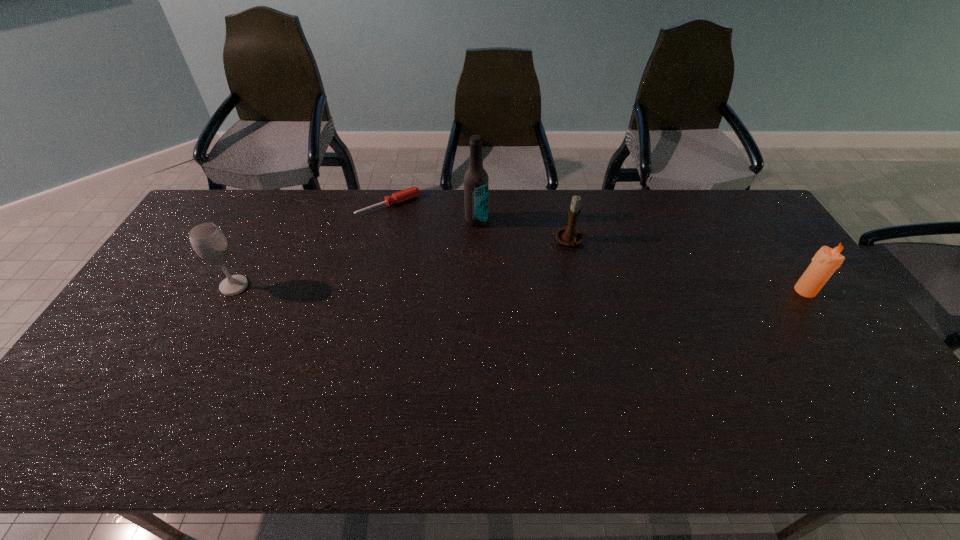
You are a GUI agent. You are given a task and a screenshot of the screen. Output one action in this format:
    pyautogui.click(x=<x>, y=<y>)
    Task: Click on the vacant region that satisfies the following two spatial constraints: 1. on the front side of the candle; 2. on the left side of the third object from right to left
    The height and width of the screenshot is (540, 960).
    Given the screenshot: What is the action you would take?
    pyautogui.click(x=476, y=291)

At what (x,y) coordinates should I click in order to perform the action: click on free space that satisfies the following two spatial constraints: 1. on the back side of the third farthest object; 2. on the left side of the leftmost object. Please return your answer as a coordinate pair (x, y). Looking at the image, I should click on (257, 242).

I want to click on vacant point that satisfies the following two spatial constraints: 1. on the front side of the candle; 2. on the right side of the fourth object from right to left, so click(x=368, y=291).